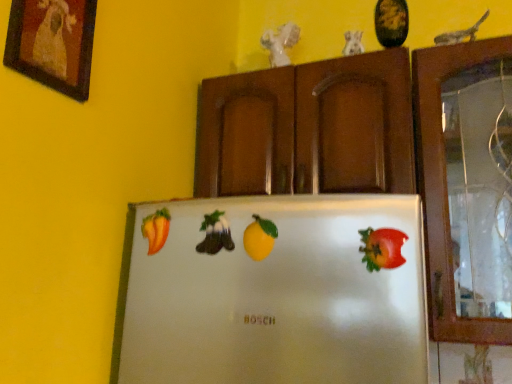
In order to face yellow matte lemon at center, which is the third fruit from left to right, should I rotate leftwards or rightwards?

It's best to rotate right around 0.481 degrees.

The width and height of the screenshot is (512, 384). I want to click on shiny red apple at right, arranged as the first fruit when viewed from the front, so click(x=382, y=248).

Locate an element on the screen. Image resolution: width=512 pixels, height=384 pixels. wooden framed picture at upper left is located at coordinates (53, 43).

The height and width of the screenshot is (384, 512). What do you see at coordinates (156, 230) in the screenshot? I see `smooth orange pepper at left, the 4th fruit positioned from the right` at bounding box center [156, 230].

Locate an element on the screen. smooth orange pepper at left, the 1th fruit viewed from the back is located at coordinates 156,230.

Where is `yellow matte lemon at center, positioned as the second fruit in front-to-back order`? The width and height of the screenshot is (512, 384). yellow matte lemon at center, positioned as the second fruit in front-to-back order is located at coordinates click(259, 238).

Can you confirm if smooth orange pepper at left, the 4th fruit positioned from the right, is positioned to the right of green matte bell pepper at center, the 2th fruit positioned from the left?

Incorrect, smooth orange pepper at left, the 4th fruit positioned from the right, is not on the right side of green matte bell pepper at center, the 2th fruit positioned from the left.

The height and width of the screenshot is (384, 512). There is a green matte bell pepper at center, the 2th fruit positioned from the left. In order to click on fruit above it (from a real-world perspective) in this screenshot , I will do `click(156, 230)`.

Which object is further away from the camera, smooth orange pepper at left, the 1th fruit viewed from the back, or green matte bell pepper at center, the third fruit viewed from the front?

Positioned behind is smooth orange pepper at left, the 1th fruit viewed from the back.

Is smooth orange pepper at left, the 4th fruit positioned from the right, oriented away from green matte bell pepper at center, the 2th fruit positioned from the left?

smooth orange pepper at left, the 4th fruit positioned from the right, does not have its back to green matte bell pepper at center, the 2th fruit positioned from the left.

From the image's perspective, is brown wood cabinetry at upper center positioned above or below shiny red apple at right, arranged as the first fruit when viewed from the front?

Based on their image positions, brown wood cabinetry at upper center is located above shiny red apple at right, arranged as the first fruit when viewed from the front.

This screenshot has width=512, height=384. Identify the location of the 4th fruit positioned below the brown wood cabinetry at upper center (from a real-world perspective). (382, 248).

Considering the sizes of objects brown wood cabinetry at upper center and shiny red apple at right, arranged as the first fruit when viewed from the front, in the image provided, who is taller, brown wood cabinetry at upper center or shiny red apple at right, arranged as the first fruit when viewed from the front,?

With more height is brown wood cabinetry at upper center.

Is brown wood cabinetry at upper center outside of shiny red apple at right, which ranks as the fourth fruit in back-to-front order?

Absolutely, brown wood cabinetry at upper center is external to shiny red apple at right, which ranks as the fourth fruit in back-to-front order.

Can you confirm if green matte bell pepper at center, which is counted as the second fruit, starting from the back, is smaller than brown wood cabinetry at upper center?

Indeed, green matte bell pepper at center, which is counted as the second fruit, starting from the back, has a smaller size compared to brown wood cabinetry at upper center.

From a real-world perspective, which object rests below the other?

In real-world perspective, green matte bell pepper at center, which is counted as the 3th fruit, starting from the right, is lower.

From the image's perspective, does brown wood cabinetry at upper center appear lower than smooth orange pepper at left, which is counted as the 4th fruit, starting from the front?

No, from the image's perspective, brown wood cabinetry at upper center is not below smooth orange pepper at left, which is counted as the 4th fruit, starting from the front.

Is brown wood cabinetry at upper center not inside smooth orange pepper at left, which is counted as the 4th fruit, starting from the front?

brown wood cabinetry at upper center is positioned outside smooth orange pepper at left, which is counted as the 4th fruit, starting from the front.

Does point (404, 66) appear closer or farther from the camera than point (169, 215)?

Point (404, 66) is farther from the camera than point (169, 215).

Is brown wood cabinetry at upper center with smooth orange pepper at left, the first fruit from the left?

There is a gap between brown wood cabinetry at upper center and smooth orange pepper at left, the first fruit from the left.

Where is `picture frame in front of the green matte bell pepper at center, which is counted as the second fruit, starting from the back`? picture frame in front of the green matte bell pepper at center, which is counted as the second fruit, starting from the back is located at coordinates (53, 43).

Between green matte bell pepper at center, which is counted as the second fruit, starting from the back, and wooden framed picture at upper left, which one is positioned in front?

wooden framed picture at upper left is in front.

Which of these two, green matte bell pepper at center, which is counted as the 3th fruit, starting from the right, or wooden framed picture at upper left, stands taller?

Standing taller between the two is wooden framed picture at upper left.

From a real-world perspective, which object stands above the other?

wooden framed picture at upper left, from a real-world perspective.

How far apart are shiny red apple at right, the 4th fruit when ordered from left to right, and wooden framed picture at upper left?

shiny red apple at right, the 4th fruit when ordered from left to right, is 65.39 centimeters away from wooden framed picture at upper left.

In terms of height, does shiny red apple at right, the 4th fruit when ordered from left to right, look taller or shorter compared to wooden framed picture at upper left?

In the image, shiny red apple at right, the 4th fruit when ordered from left to right, appears to be shorter than wooden framed picture at upper left.

From the image's perspective, is shiny red apple at right, acting as the first fruit starting from the right, on wooden framed picture at upper left?

No.

What's the angular difference between shiny red apple at right, which ranks as the fourth fruit in back-to-front order, and wooden framed picture at upper left's facing directions?

90 degrees separate the facing orientations of shiny red apple at right, which ranks as the fourth fruit in back-to-front order, and wooden framed picture at upper left.

Measure the distance from smooth orange pepper at left, the first fruit from the left, to shiny red apple at right, the 4th fruit when ordered from left to right.

smooth orange pepper at left, the first fruit from the left, and shiny red apple at right, the 4th fruit when ordered from left to right, are 16.48 inches apart from each other.

Are smooth orange pepper at left, which is counted as the 4th fruit, starting from the front, and shiny red apple at right, which ranks as the fourth fruit in back-to-front order, making contact?

No, smooth orange pepper at left, which is counted as the 4th fruit, starting from the front, is not in contact with shiny red apple at right, which ranks as the fourth fruit in back-to-front order.

Is smooth orange pepper at left, the 1th fruit viewed from the back, facing away from shiny red apple at right, acting as the first fruit starting from the right?

smooth orange pepper at left, the 1th fruit viewed from the back, is not turned away from shiny red apple at right, acting as the first fruit starting from the right.

Is shiny red apple at right, arranged as the first fruit when viewed from the front, inside smooth orange pepper at left, which is counted as the 4th fruit, starting from the front?

No, shiny red apple at right, arranged as the first fruit when viewed from the front, is not surrounded by smooth orange pepper at left, which is counted as the 4th fruit, starting from the front.

You are a GUI agent. You are given a task and a screenshot of the screen. Output one action in this format:
    pyautogui.click(x=<x>, y=<y>)
    Task: Click on the fruit that is the 1st object directly below the smooth orange pepper at left, the 4th fruit positioned from the right (from a real-world perspective)
    Image resolution: width=512 pixels, height=384 pixels.
    Given the screenshot: What is the action you would take?
    coord(215,234)

Image resolution: width=512 pixels, height=384 pixels. There is a shiny red apple at right, the 4th fruit when ordered from left to right. Find the location of `cabinetry above it (from a real-world perspective)`. cabinetry above it (from a real-world perspective) is located at coordinates (308, 128).

From the picture: Considering their positions, is wooden framed picture at upper left positioned closer to green matte bell pepper at center, the third fruit viewed from the front, than brown wood cabinetry at upper center?

wooden framed picture at upper left.

Consider the image. When comparing their distances from green matte bell pepper at center, the 2th fruit positioned from the left, does brown wood cabinetry at upper center or smooth orange pepper at left, the first fruit from the left, seem closer?

smooth orange pepper at left, the first fruit from the left, is positioned closer to the anchor green matte bell pepper at center, the 2th fruit positioned from the left.

Looking at the image, which one is located further to brown wood cabinetry at upper center, wooden framed picture at upper left or green matte bell pepper at center, which is counted as the second fruit, starting from the back?

wooden framed picture at upper left is further to brown wood cabinetry at upper center.

From the image, which object appears to be nearer to shiny red apple at right, the 4th fruit when ordered from left to right, green matte bell pepper at center, which is counted as the second fruit, starting from the back, or yellow matte lemon at center, positioned as the second fruit in front-to-back order?

yellow matte lemon at center, positioned as the second fruit in front-to-back order, is positioned closer to the anchor shiny red apple at right, the 4th fruit when ordered from left to right.

Estimate the real-world distances between objects in this image. Which object is further from smooth orange pepper at left, the 4th fruit positioned from the right, shiny red apple at right, acting as the first fruit starting from the right, or brown wood cabinetry at upper center?

The object further to smooth orange pepper at left, the 4th fruit positioned from the right, is brown wood cabinetry at upper center.

Consider the image. Which object lies nearer to the anchor point smooth orange pepper at left, the 1th fruit viewed from the back, green matte bell pepper at center, which is counted as the 3th fruit, starting from the right, or yellow matte lemon at center, positioned as the second fruit in front-to-back order?

green matte bell pepper at center, which is counted as the 3th fruit, starting from the right, lies closer to smooth orange pepper at left, the 1th fruit viewed from the back, than the other object.

Based on their spatial positions, is wooden framed picture at upper left or green matte bell pepper at center, which is counted as the 3th fruit, starting from the right, closer to shiny red apple at right, arranged as the first fruit when viewed from the front?

green matte bell pepper at center, which is counted as the 3th fruit, starting from the right, is closer to shiny red apple at right, arranged as the first fruit when viewed from the front.

Looking at the image, which one is located further to yellow matte lemon at center, which is the third fruit from left to right, green matte bell pepper at center, the third fruit viewed from the front, or smooth orange pepper at left, which is counted as the 4th fruit, starting from the front?

smooth orange pepper at left, which is counted as the 4th fruit, starting from the front, is positioned further to the anchor yellow matte lemon at center, which is the third fruit from left to right.

The image size is (512, 384). I want to click on cabinetry between smooth orange pepper at left, the 4th fruit positioned from the right, and shiny red apple at right, arranged as the first fruit when viewed from the front, in the horizontal direction, so click(x=308, y=128).

Find the location of a particular element. This screenshot has width=512, height=384. cabinetry between wooden framed picture at upper left and shiny red apple at right, the 4th fruit when ordered from left to right, from left to right is located at coordinates (308, 128).

This screenshot has width=512, height=384. I want to click on fruit located between smooth orange pepper at left, the first fruit from the left, and yellow matte lemon at center, which is the third fruit from left to right, in the left-right direction, so click(215, 234).

The width and height of the screenshot is (512, 384). What are the coordinates of `fruit between wooden framed picture at upper left and green matte bell pepper at center, the third fruit viewed from the front, vertically` in the screenshot? It's located at (156, 230).